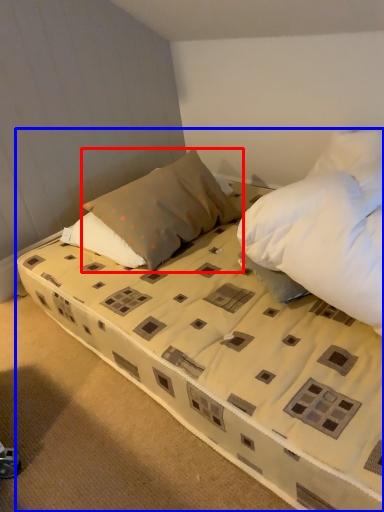
Question: Which object is closer to the camera taking this photo, pillow (highlighted by a red box) or bed (highlighted by a blue box)?

Choices:
 (A) pillow
 (B) bed

Answer: (B)